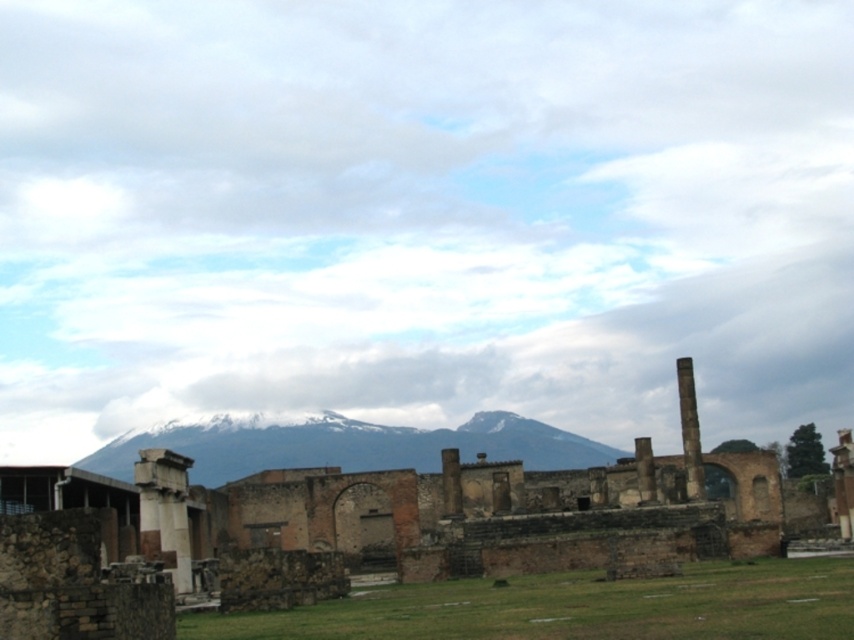
Question: Is snowy rock mountain at center smaller than white marble column at left?

Choices:
 (A) no
 (B) yes

Answer: (A)

Question: Among these objects, which one is farthest from the camera?

Choices:
 (A) brown stone ruins at center
 (B) snowy rock mountain at center
 (C) white marble column at left
 (D) smooth stone pillar at center

Answer: (B)

Question: Can you confirm if brown stone ruins at center is thinner than smooth stone pillar at center?

Choices:
 (A) no
 (B) yes

Answer: (A)

Question: Is brown stone ruins at center thinner than white marble column at left?

Choices:
 (A) yes
 (B) no

Answer: (B)

Question: Considering the real-world distances, which object is farthest from the white marble column at left?

Choices:
 (A) smooth stone pillar at center
 (B) brown stone ruins at center

Answer: (A)

Question: Which point is closer to the camera?

Choices:
 (A) (150, 484)
 (B) (449, 548)
 (C) (414, 428)

Answer: (A)